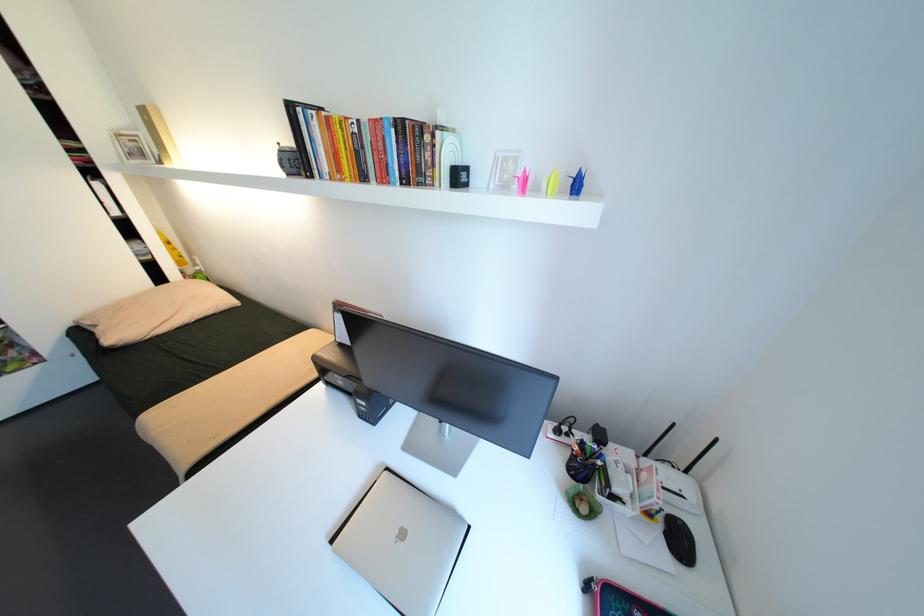
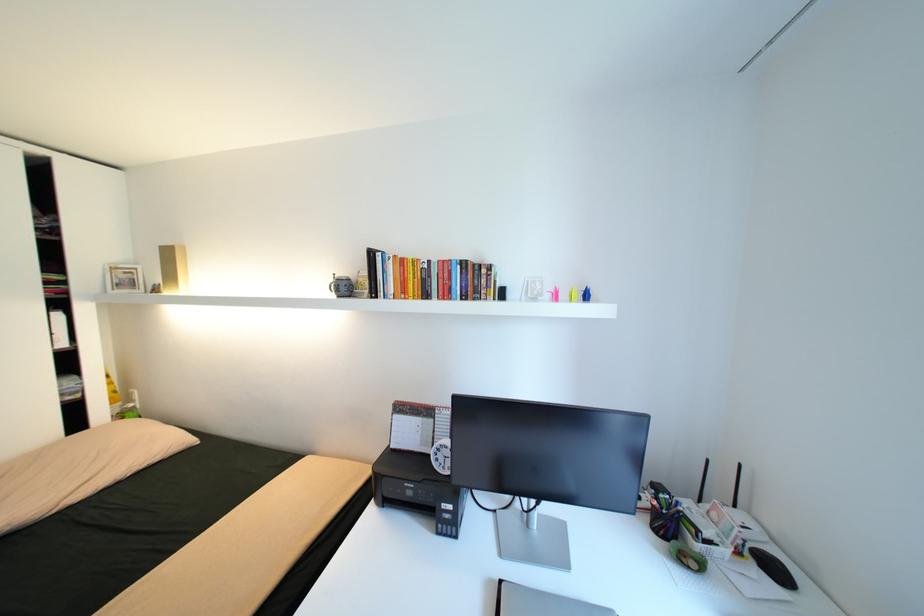
Find the pixel in the second image that matches pixel 377 121 in the first image.

(445, 262)